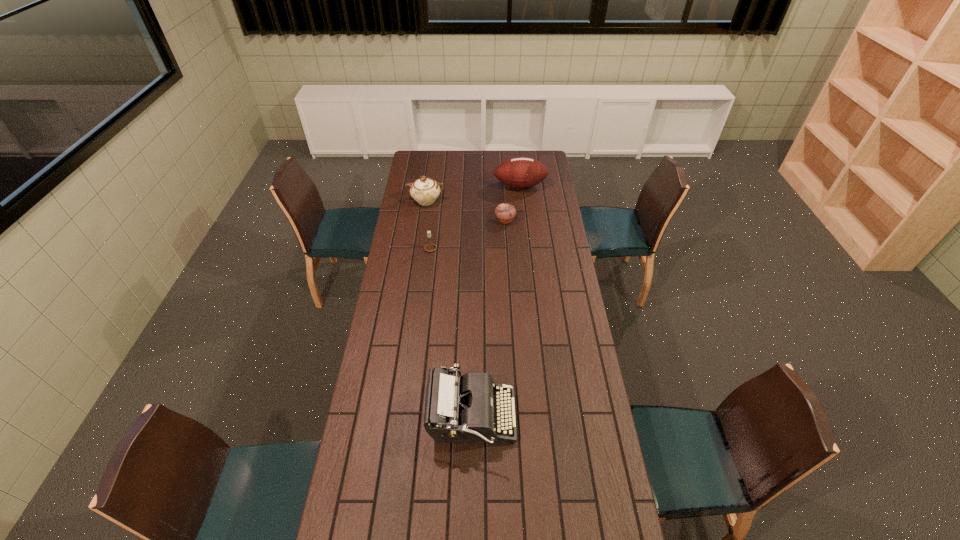
This screenshot has width=960, height=540. In order to click on football (American) in this screenshot , I will do `click(519, 172)`.

Where is `chinaware`? chinaware is located at coordinates (425, 191).

Image resolution: width=960 pixels, height=540 pixels. I want to click on typewriter, so click(x=458, y=409).

The image size is (960, 540). Identify the location of the second shortest object. (430, 247).

The width and height of the screenshot is (960, 540). In order to click on the second nearest object in this screenshot , I will do `click(430, 247)`.

At what (x,y) coordinates should I click in order to perform the action: click on the shortest object. Please return your answer as a coordinate pair (x, y). The height and width of the screenshot is (540, 960). Looking at the image, I should click on (505, 213).

Image resolution: width=960 pixels, height=540 pixels. In order to click on the third nearest object in this screenshot , I will do `click(505, 213)`.

The width and height of the screenshot is (960, 540). What are the coordinates of `vacant area located on the left of the football (American)` in the screenshot? It's located at (436, 186).

You are a GUI agent. You are given a task and a screenshot of the screen. Output one action in this format:
    pyautogui.click(x=<x>, y=<y>)
    Task: Click on the free region located on the back of the chinaware
    The width and height of the screenshot is (960, 540).
    Given the screenshot: What is the action you would take?
    pyautogui.click(x=429, y=181)

You are a GUI agent. You are given a task and a screenshot of the screen. Output one action in this format:
    pyautogui.click(x=<x>, y=<y>)
    Task: Click on the vacant area located on the front-facing side of the typewriter
    This screenshot has height=540, width=960.
    Given the screenshot: What is the action you would take?
    pyautogui.click(x=536, y=418)